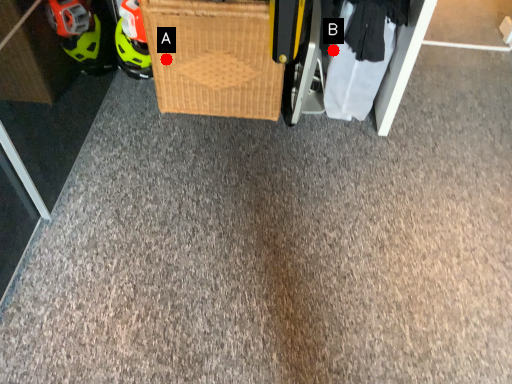
Question: Two points are circled on the image, labeled by A and B beside each circle. Which point is further to the camera?

Choices:
 (A) A is further
 (B) B is further

Answer: (B)